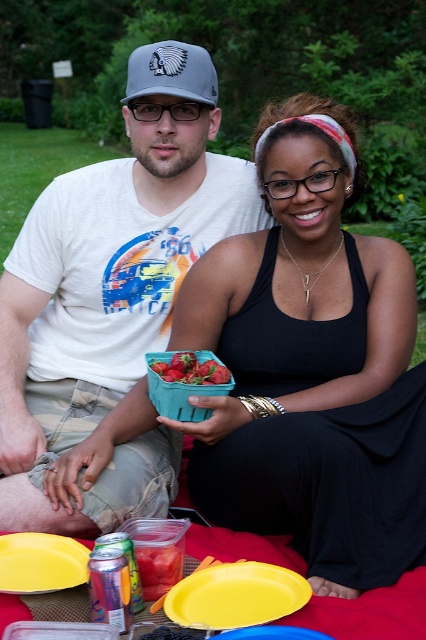
Between yellow plastic plate at lower center and gray fabric baseball cap at upper center, which one is positioned lower?

yellow plastic plate at lower center is below.

Between point (287, 612) and point (180, 84), which one is positioned behind?

The point (180, 84) is more distant.

Which is behind, point (230, 600) or point (170, 51)?

The point (170, 51) is behind.

Where is `yellow plastic plate at lower center`? Image resolution: width=426 pixels, height=640 pixels. yellow plastic plate at lower center is located at coordinates (236, 595).

Who is positioned more to the left, yellow plastic plate at lower center or ripe strawberry at center?

ripe strawberry at center

From the picture: Does yellow plastic plate at lower center have a lesser width compared to ripe strawberry at center?

No.

Who is more forward, [296,586] or [195,380]?

Point [296,586] is more forward.

This screenshot has width=426, height=640. What are the coordinates of `yellow plastic plate at lower center` in the screenshot? It's located at (236, 595).

Is matte white t-shirt at center further to the viewer compared to gray fabric baseball cap at upper center?

No.

Can you confirm if matte white t-shirt at center is taller than gray fabric baseball cap at upper center?

Yes.

Is point (40, 500) closer to camera compared to point (187, 51)?

That is True.

Locate an element on the screen. This screenshot has width=426, height=640. matte white t-shirt at center is located at coordinates (112, 292).